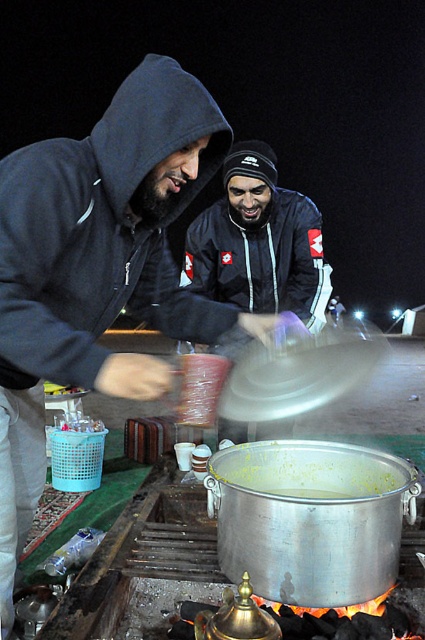
You are a photographer trying to capture both the matte black hoodie at center and the black matte jacket at center in a single frame. Since the two objects are at the same center position, which one do you need to focus on first to ensure both are in focus?

The matte black hoodie at center is taller than the black matte jacket at center, so you should focus on the taller matte black hoodie at center first to ensure both are in focus.

You are standing in the same area as the two people in the image. The person in the matte black hoodie at center is holding a pot. If you want to hand them a spoon, should you walk towards point (98, 268)?

Yes, you should walk towards point (98, 268) because the matte black hoodie at center is represented by that point.